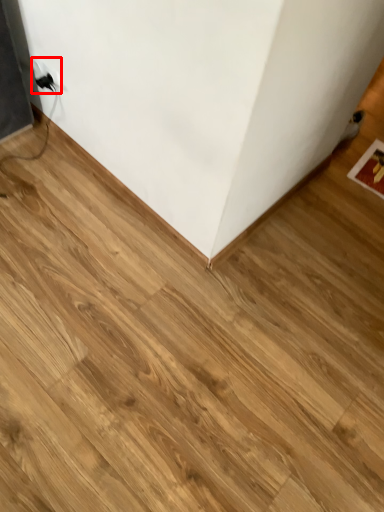
Question: From the image's perspective, where is electric outlet (annotated by the red box) located relative to furniture?

Choices:
 (A) below
 (B) above

Answer: (B)